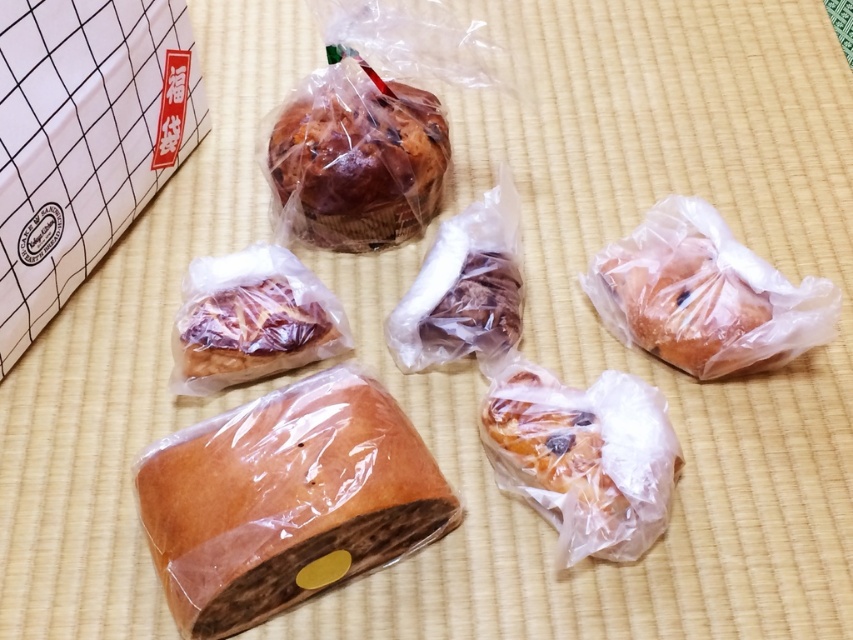
Consider the image. You are arranging a display of baked goods on a traditional Japanese tatami mat. You have a golden brown crusty loaf at center. Where exactly should you place it to match the image?

The golden brown crusty loaf at center should be placed at point 0.780 on the x axis and 0.335 on the y axis.

You are arranging pastries on a traditional Japanese tatami mat. You need to place a new pastry at the position currently occupied by the brown glossy muffin at upper center. What are the coordinates of the spot where you should place the new pastry?

The coordinates of the spot where you should place the new pastry are at point (x=358, y=163), which is where the brown glossy muffin at upper center is currently located.